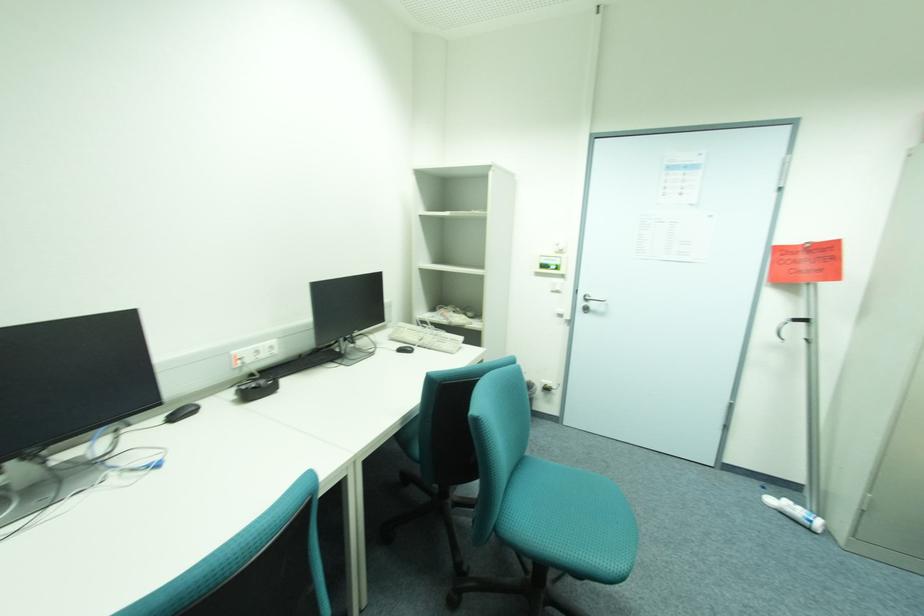
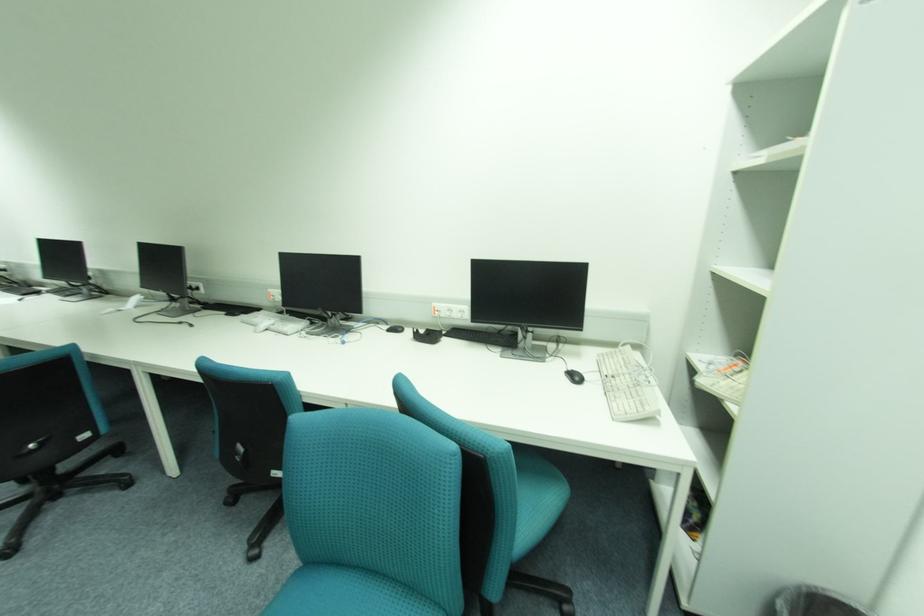
Find the pixel in the second image that matches (240,353) in the first image.

(441, 305)